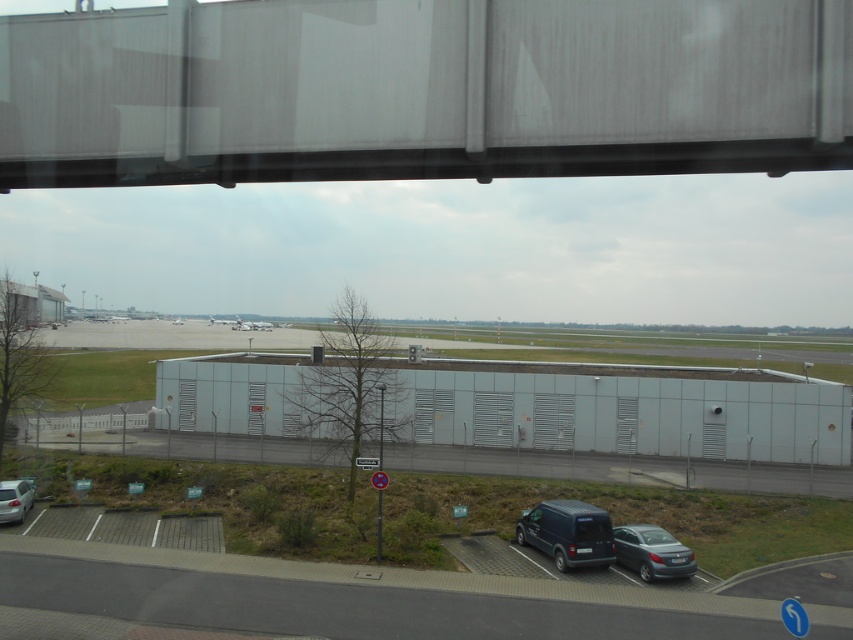
You are a parking attendant who needs to fit a tall delivery truck into a parking spot. You see the metallic gray sedan at lower right and the silver metallic van at lower left. Which vehicle should you move to ensure enough vertical clearance?

You should move the silver metallic van at lower left because the metallic gray sedan at lower right is shorter in height, so removing the taller van would provide more vertical space for the delivery truck.

You are standing at the point marked as point (619, 410) in the image. What type of building are you currently located on?

The point (619, 410) is on a gray metallic building at center, so you are currently located on a gray metallic building at center.